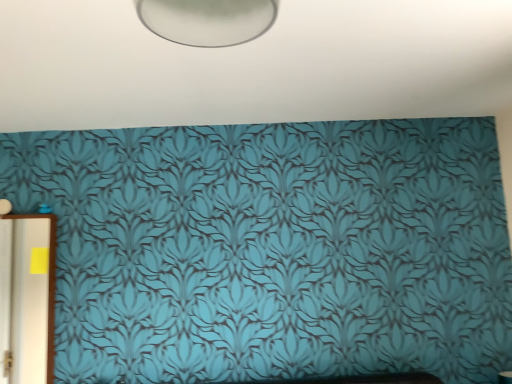
Question: From a real-world perspective, is white glossy door at left positioned above or below teal wallpaper at center?

Choices:
 (A) below
 (B) above

Answer: (A)

Question: Is white glossy door at left bigger or smaller than teal wallpaper at center?

Choices:
 (A) small
 (B) big

Answer: (A)

Question: Visually, is white glossy door at left positioned to the left or to the right of teal wallpaper at center?

Choices:
 (A) right
 (B) left

Answer: (B)

Question: Considering the positions of teal wallpaper at center and white glossy door at left in the image, is teal wallpaper at center taller or shorter than white glossy door at left?

Choices:
 (A) tall
 (B) short

Answer: (B)

Question: Does point (13, 99) appear closer or farther from the camera than point (35, 352)?

Choices:
 (A) farther
 (B) closer

Answer: (B)

Question: Do you think teal wallpaper at center is within white glossy door at left, or outside of it?

Choices:
 (A) inside
 (B) outside

Answer: (B)

Question: Considering their positions, is teal wallpaper at center located in front of or behind white glossy door at left?

Choices:
 (A) behind
 (B) front

Answer: (B)